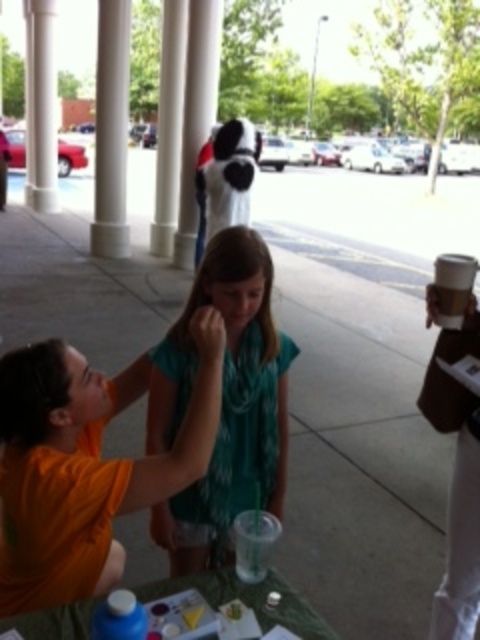
You are an architect designing a new building and want to ensure the pillars and columns in the entrance align properly. Given the scene, which of the two objects, the white smooth pillar at upper center or the white smooth column at upper left, should be placed closer to the entrance to maintain structural balance?

The white smooth pillar at upper center is shorter than the white smooth column at upper left, so to maintain structural balance, the shorter pillar should be placed closer to the entrance while the taller column is positioned further back.

You are standing in the scene and want to take a photo of the teal fabric scarf at center without the white smooth pillar at upper center blocking the view. Is the scarf already positioned in a way that allows this?

Yes, the teal fabric scarf at center is in front of the white smooth pillar at upper center, so it is not blocked and can be photographed without obstruction.

You are a photographer setting up for a photoshoot in this location. You need to place a tall tripod between the teal fabric scarf at center and the translucent plastic table at lower center. Which object should you position the tripod closer to to ensure it doesn

The teal fabric scarf at center is taller than the translucent plastic table at lower center. To ensure the tripod is placed appropriately for the photoshoot, position it closer to the translucent plastic table at lower center to avoid obstructions from the taller scarf.